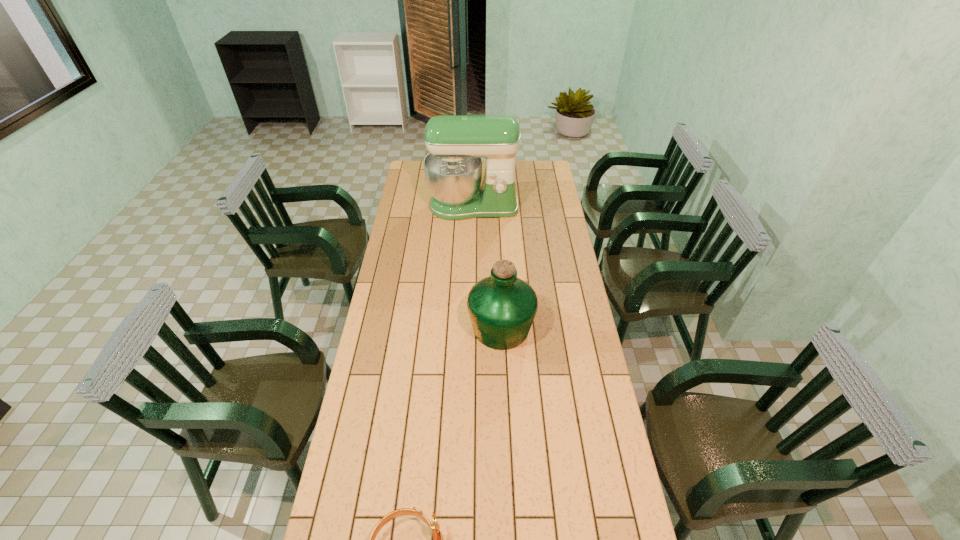
In the image, there is a desktop. At what (x,y) coordinates should I click in order to perform the action: click on free region at the right edge. Please return your answer as a coordinate pair (x, y). Looking at the image, I should click on (612, 476).

Image resolution: width=960 pixels, height=540 pixels. In the image, there is a desktop. In order to click on vacant region at the far left corner in this screenshot , I will do `click(417, 172)`.

What are the coordinates of `vacant space in between the second nearest object and the mixer` in the screenshot? It's located at (487, 267).

In order to click on object identified as the second closest to the second tallest object in this screenshot , I will do `click(437, 539)`.

You are a GUI agent. You are given a task and a screenshot of the screen. Output one action in this format:
    pyautogui.click(x=<x>, y=<y>)
    Task: Click on the object that stands as the closest to the mixer
    
    Given the screenshot: What is the action you would take?
    [502, 307]